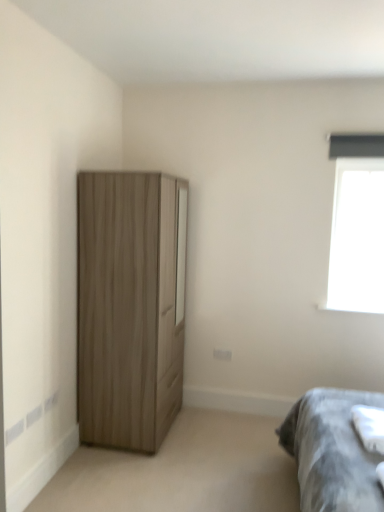
Question: Does gray fabric bedsheet at lower right have a greater height compared to wooden wardrobe at left?

Choices:
 (A) no
 (B) yes

Answer: (A)

Question: From the image's perspective, does gray fabric bedsheet at lower right appear lower than wooden wardrobe at left?

Choices:
 (A) yes
 (B) no

Answer: (A)

Question: Is wooden wardrobe at left a part of gray fabric bedsheet at lower right?

Choices:
 (A) yes
 (B) no

Answer: (B)

Question: Is gray fabric bedsheet at lower right next to wooden wardrobe at left?

Choices:
 (A) no
 (B) yes

Answer: (A)

Question: Is gray fabric bedsheet at lower right positioned far away from wooden wardrobe at left?

Choices:
 (A) no
 (B) yes

Answer: (B)

Question: Does point (357, 210) appear closer or farther from the camera than point (372, 413)?

Choices:
 (A) closer
 (B) farther

Answer: (B)

Question: Do you think transparent glass window at upper right is within gray fabric bedsheet at lower right, or outside of it?

Choices:
 (A) inside
 (B) outside

Answer: (B)

Question: Considering the positions of transparent glass window at upper right and gray fabric bedsheet at lower right in the image, is transparent glass window at upper right taller or shorter than gray fabric bedsheet at lower right?

Choices:
 (A) tall
 (B) short

Answer: (A)

Question: From a real-world perspective, is transparent glass window at upper right positioned above or below gray fabric bedsheet at lower right?

Choices:
 (A) above
 (B) below

Answer: (A)

Question: Considering the positions of gray fabric bedsheet at lower right and transparent glass window at upper right in the image, is gray fabric bedsheet at lower right taller or shorter than transparent glass window at upper right?

Choices:
 (A) short
 (B) tall

Answer: (A)

Question: Is gray fabric bedsheet at lower right bigger or smaller than transparent glass window at upper right?

Choices:
 (A) small
 (B) big

Answer: (A)

Question: Choose the correct answer: Is gray fabric bedsheet at lower right inside transparent glass window at upper right or outside it?

Choices:
 (A) inside
 (B) outside

Answer: (B)

Question: Is gray fabric bedsheet at lower right to the left or to the right of transparent glass window at upper right in the image?

Choices:
 (A) left
 (B) right

Answer: (A)

Question: From their relative heights in the image, would you say wooden wardrobe at left is taller or shorter than gray fabric bedsheet at lower right?

Choices:
 (A) short
 (B) tall

Answer: (B)

Question: Based on their positions, is wooden wardrobe at left located to the left or right of gray fabric bedsheet at lower right?

Choices:
 (A) right
 (B) left

Answer: (B)